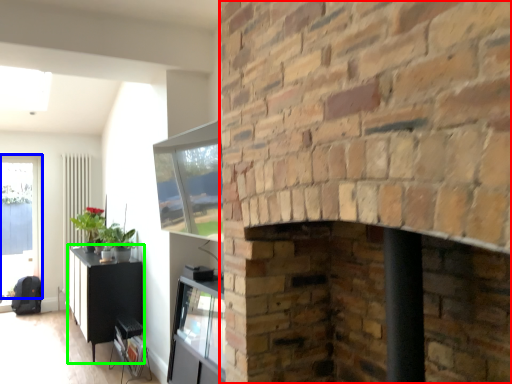
Question: Based on their relative distances, which object is farther from fireplace (highlighted by a red box)? Choose from window (highlighted by a blue box) and table (highlighted by a green box).

Choices:
 (A) window
 (B) table

Answer: (A)